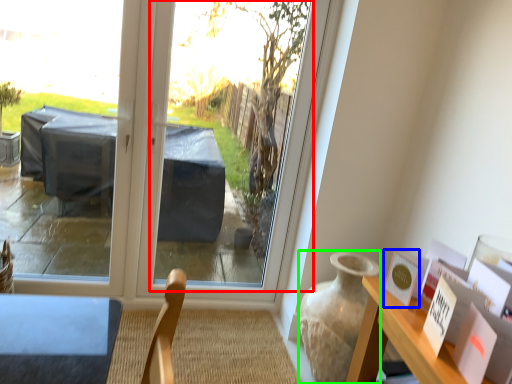
Question: Based on their relative distances, which object is nearer to window screen (highlighted by a red box)? Choose from postcard (highlighted by a blue box) and vase (highlighted by a green box).

Choices:
 (A) postcard
 (B) vase

Answer: (B)